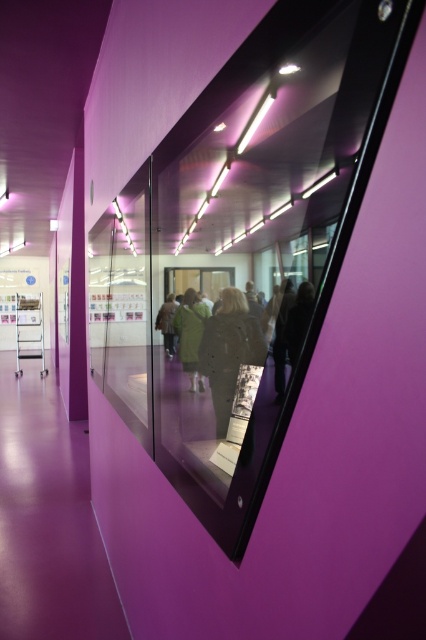
Is green fabric coat at center further to camera compared to green fabric jacket at center?

That is False.

Can you confirm if green fabric coat at center is wider than green fabric jacket at center?

Indeed, green fabric coat at center has a greater width compared to green fabric jacket at center.

This screenshot has height=640, width=426. Describe the element at coordinates (190, 333) in the screenshot. I see `green fabric coat at center` at that location.

I want to click on green fabric coat at center, so click(x=190, y=333).

Is dark gray fabric coat at center closer to the viewer compared to dark gray textured coat at center?

Yes, it is in front of dark gray textured coat at center.

Which is behind, point (190, 317) or point (236, 376)?

Point (190, 317)

Is point (221, 307) more distant than point (250, 317)?

That is True.

Locate an element on the screen. The height and width of the screenshot is (640, 426). dark gray fabric coat at center is located at coordinates [219, 346].

Does dark gray textured coat at center have a greater width compared to green fabric jacket at center?

Indeed, dark gray textured coat at center has a greater width compared to green fabric jacket at center.

Which is in front, point (247, 362) or point (158, 316)?

Point (247, 362)

Identify the location of dark gray textured coat at center. (229, 352).